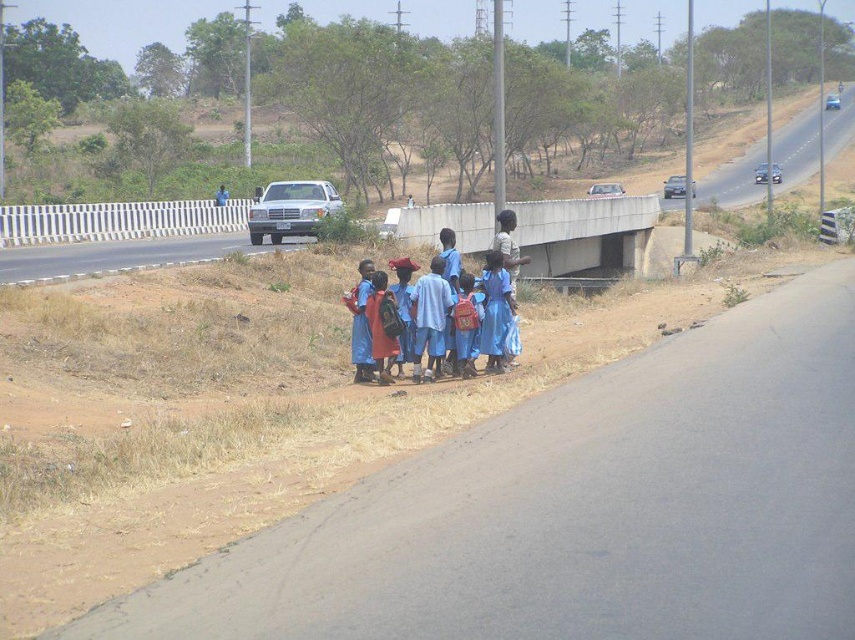
Is brown asphalt highway at lower center further to the viewer compared to asphalt road at upper right?

No, brown asphalt highway at lower center is in front of asphalt road at upper right.

Can you confirm if brown asphalt highway at lower center is shorter than asphalt road at upper right?

Yes.

Which is behind, point (782, 570) or point (777, 188)?

The point (777, 188) is more distant.

The height and width of the screenshot is (640, 855). What are the coordinates of `brown asphalt highway at lower center` in the screenshot? It's located at (579, 509).

Between point (755, 184) and point (470, 291), which one is positioned behind?

Point (755, 184)

Which is more to the left, asphalt road at upper right or matte red backpack at center?

matte red backpack at center

Which is behind, point (803, 176) or point (472, 300)?

The point (803, 176) is behind.

I want to click on asphalt road at upper right, so click(x=811, y=138).

Can you confirm if brown asphalt highway at lower center is thinner than concrete at center?

Yes, brown asphalt highway at lower center is thinner than concrete at center.

In the scene shown: Does brown asphalt highway at lower center have a lesser height compared to concrete at center?

Correct, brown asphalt highway at lower center is not as tall as concrete at center.

Between point (715, 323) and point (457, 227), which one is positioned behind?

The point (457, 227) is more distant.

Locate an element on the screen. The height and width of the screenshot is (640, 855). brown asphalt highway at lower center is located at coordinates (579, 509).